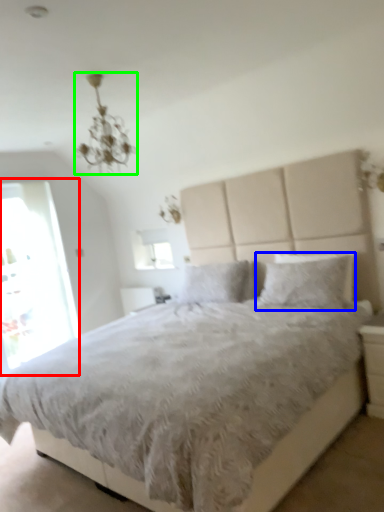
Question: Which object is positioned farthest from glass door (highlighted by a red box)? Select from pillow (highlighted by a blue box) and light fixture (highlighted by a green box).

Choices:
 (A) pillow
 (B) light fixture

Answer: (A)